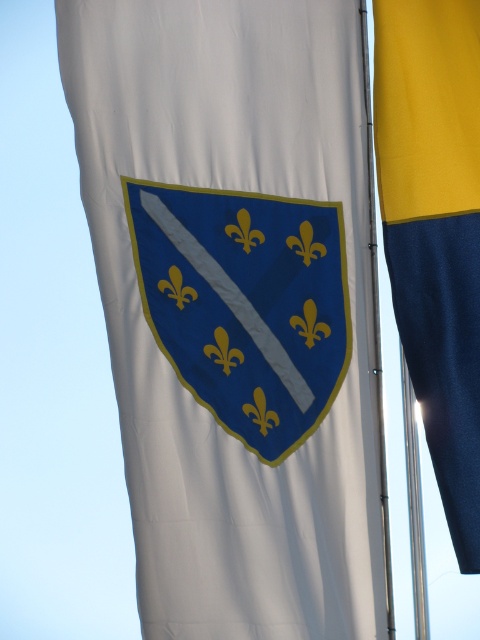
You are a photographer trying to capture both the yellow fabric flag at right and the metallic silver pole at center in a single frame. Given their sizes, which object will appear bigger in your photo?

The yellow fabric flag at right will appear bigger in the photo since it has a larger size compared to the metallic silver pole at center.

You are standing in front of the two flags and notice the blue fabric shield at center and the metallic silver pole at center. Which object is positioned to the left of the other?

The blue fabric shield at center is to the left of the metallic silver pole at center.

You are a photographer trying to capture both the blue fabric shield at center and the metallic silver pole at center in a single frame. Based on their positions, which object should you focus on first to ensure both are in the frame?

The blue fabric shield at center is located above the metallic silver pole at center, so you should focus on the metallic silver pole at center first to ensure both are in the frame.